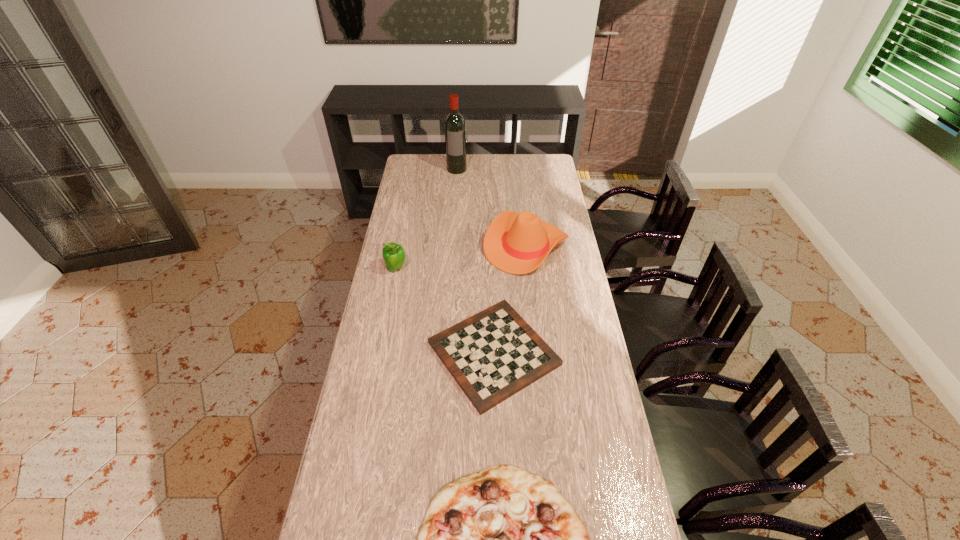
Identify the location of unoccupied area between the wine bottle and the bell pepper. The width and height of the screenshot is (960, 540). (426, 219).

The width and height of the screenshot is (960, 540). Find the location of `vacant space in between the farthest object and the chessboard`. vacant space in between the farthest object and the chessboard is located at coordinates (475, 261).

Locate an element on the screen. unoccupied area between the chessboard and the cowboy hat is located at coordinates (510, 300).

Locate an element on the screen. The width and height of the screenshot is (960, 540). empty space between the farthest object and the fourth farthest object is located at coordinates (475, 261).

Select which object is the second closest to the wine bottle. Please provide its 2D coordinates. Your answer should be formatted as a tuple, i.e. [(x, y)], where the tuple contains the x and y coordinates of a point satisfying the conditions above.

[(393, 254)]

Find the location of `the closest object to the wine bottle`. the closest object to the wine bottle is located at coordinates (517, 243).